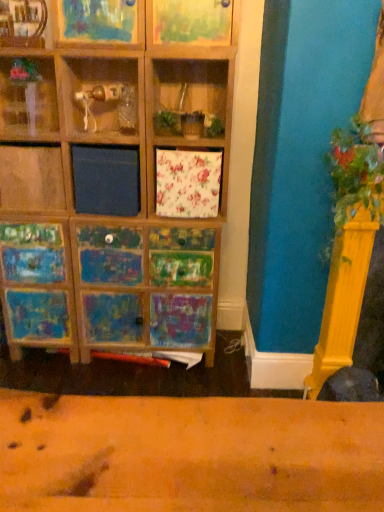
Question: Is green leafy plant at right turned away from wooden frame at upper center, which is the third shelf in left-to-right order?

Choices:
 (A) yes
 (B) no

Answer: (B)

Question: Is green leafy plant at right shorter than wooden frame at upper center, arranged as the first shelf when viewed from the right?

Choices:
 (A) no
 (B) yes

Answer: (A)

Question: Is the depth of green leafy plant at right greater than that of wooden frame at upper center, arranged as the first shelf when viewed from the right?

Choices:
 (A) yes
 (B) no

Answer: (B)

Question: Considering the relative positions of green leafy plant at right and wooden frame at upper center, arranged as the first shelf when viewed from the right, in the image provided, is green leafy plant at right to the left of wooden frame at upper center, arranged as the first shelf when viewed from the right, from the viewer's perspective?

Choices:
 (A) no
 (B) yes

Answer: (A)

Question: Considering the relative positions of green leafy plant at right and wooden frame at upper center, which is the third shelf in left-to-right order, in the image provided, is green leafy plant at right to the right of wooden frame at upper center, which is the third shelf in left-to-right order, from the viewer's perspective?

Choices:
 (A) no
 (B) yes

Answer: (B)

Question: From a real-world perspective, is wooden shelf at upper left, arranged as the second shelf when viewed from the right, physically located above or below wooden frame at upper center, which is the third shelf in left-to-right order?

Choices:
 (A) above
 (B) below

Answer: (B)

Question: From the image's perspective, is wooden shelf at upper left, arranged as the second shelf when viewed from the right, positioned above or below wooden frame at upper center, which is the third shelf in left-to-right order?

Choices:
 (A) above
 (B) below

Answer: (B)

Question: Is point (34, 36) closer or farther from the camera than point (72, 10)?

Choices:
 (A) closer
 (B) farther

Answer: (B)

Question: Based on their sizes in the image, would you say wooden shelf at upper left, arranged as the second shelf when viewed from the right, is bigger or smaller than wooden frame at upper center, which is the third shelf in left-to-right order?

Choices:
 (A) small
 (B) big

Answer: (A)

Question: Is wooden frame at upper center, arranged as the first shelf when viewed from the right, in front of or behind green leafy plant at right in the image?

Choices:
 (A) front
 (B) behind

Answer: (B)

Question: Does point (87, 19) appear closer or farther from the camera than point (332, 164)?

Choices:
 (A) closer
 (B) farther

Answer: (B)

Question: Is wooden frame at upper center, which is the third shelf in left-to-right order, inside the boundaries of green leafy plant at right, or outside?

Choices:
 (A) inside
 (B) outside

Answer: (B)

Question: Based on their sizes in the image, would you say wooden frame at upper center, arranged as the first shelf when viewed from the right, is bigger or smaller than green leafy plant at right?

Choices:
 (A) small
 (B) big

Answer: (A)

Question: Looking at their shapes, would you say green leafy plant at right is wider or thinner than wooden frame at upper center, arranged as the first shelf when viewed from the right?

Choices:
 (A) wide
 (B) thin

Answer: (A)

Question: From their relative heights in the image, would you say green leafy plant at right is taller or shorter than wooden frame at upper center, which is the third shelf in left-to-right order?

Choices:
 (A) short
 (B) tall

Answer: (B)